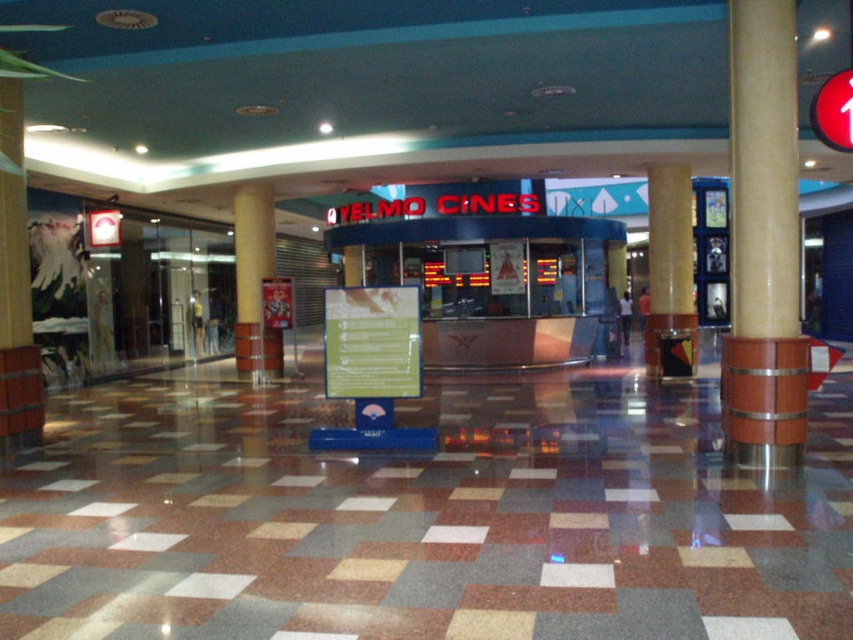
You are standing at the entrance of Yelmo Cines and need to locate the ticket counter. According to the image, where is the brown polished wood at center located in terms of coordinates?

The brown polished wood at center is located at coordinates point (763, 241).

You are standing in the mall entrance and want to buy a movie ticket. There are two pillars in front of you, the brown marble pillar at center and the brown polished pillar at center. Which pillar should you stand next to if you want to be on the left side of the ticket counter?

You should stand next to the brown polished pillar at center because the brown marble pillar at center is to its right, meaning the brown polished pillar at center is on the left side of the ticket counter.